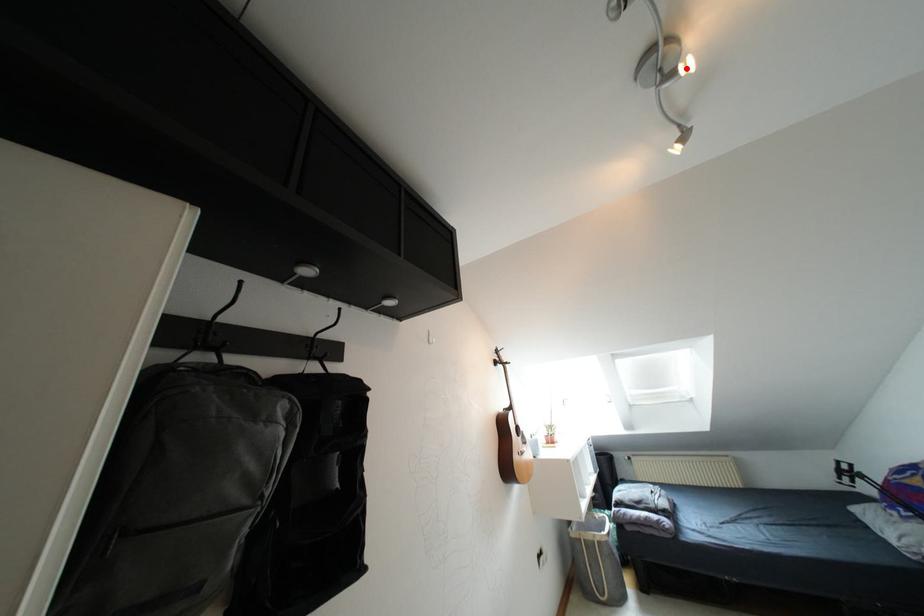
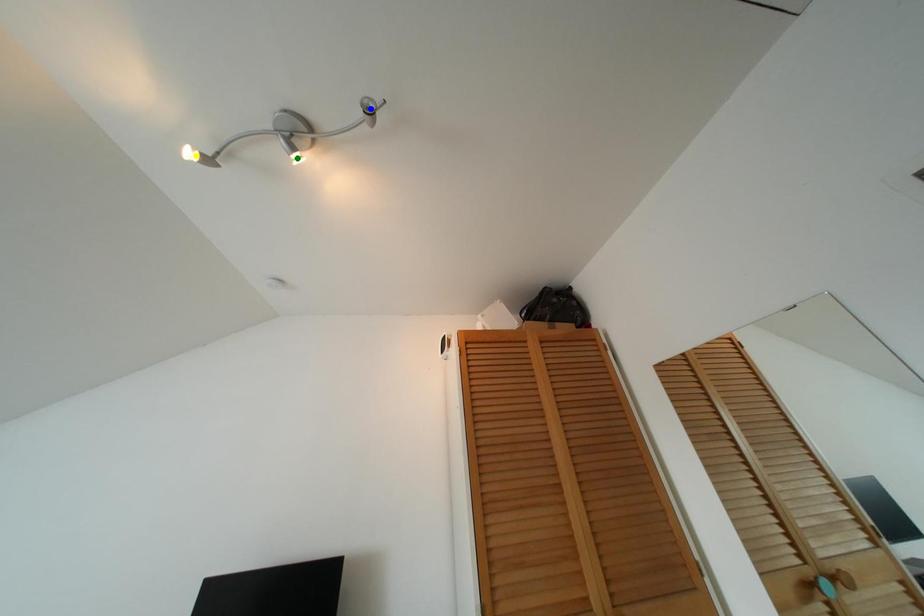
Question: I am providing you with two images of the same scene from different viewpoints. A red point is marked on the first image. You are given multiple points on the second image. Which spot in image 2 lines up with the point in image 1?

Choices:
 (A) blue point
 (B) green point
 (C) yellow point

Answer: (B)